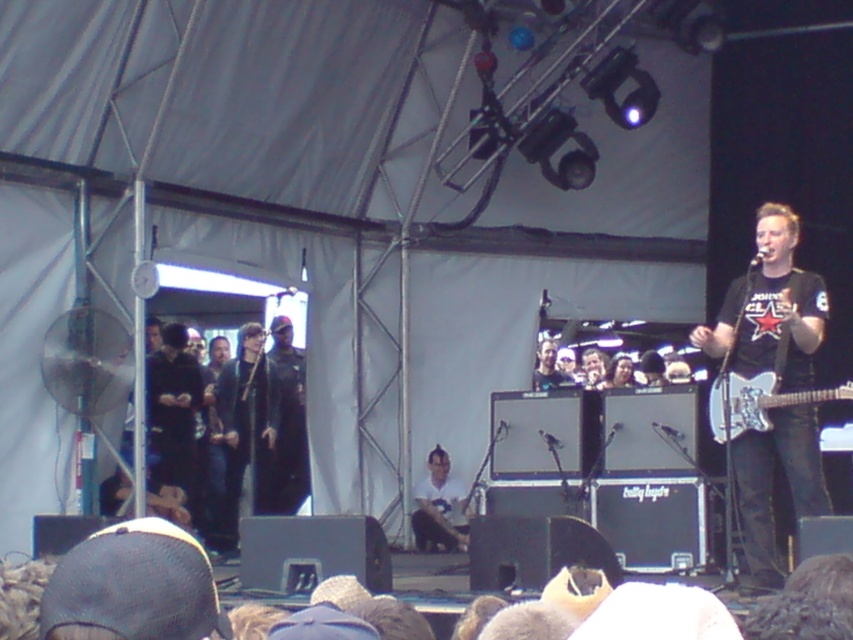
Between black leather jacket at left and white glossy electric guitar at right, which one has more height?

With more height is black leather jacket at left.

In the scene shown: Is black leather jacket at left shorter than white glossy electric guitar at right?

No.

In order to click on black leather jacket at left in this screenshot , I will do `click(172, 413)`.

Between point (744, 406) and point (451, 538), which one is positioned in front?

Point (744, 406) is in front.

Is white glossy electric guitar at right above metallic silver guitar at center?

Indeed, white glossy electric guitar at right is positioned over metallic silver guitar at center.

This screenshot has width=853, height=640. I want to click on white glossy electric guitar at right, so click(757, 401).

This screenshot has height=640, width=853. I want to click on white glossy electric guitar at right, so click(757, 401).

Does black leather jacket at left have a greater height compared to metallic silver guitar at center?

Yes, black leather jacket at left is taller than metallic silver guitar at center.

Does point (164, 458) lie behind point (421, 520)?

No, (164, 458) is in front of (421, 520).

Where is `black leather jacket at left`? The width and height of the screenshot is (853, 640). black leather jacket at left is located at coordinates (172, 413).